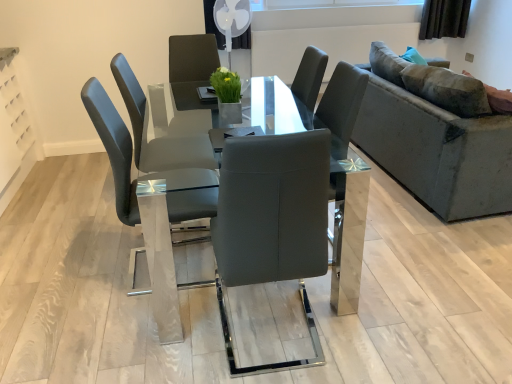
Question: Would you say velvet grey couch at right is a long distance from matte gray chair at center?

Choices:
 (A) yes
 (B) no

Answer: (A)

Question: Is velvet grey couch at right positioned in front of matte gray chair at center?

Choices:
 (A) yes
 (B) no

Answer: (B)

Question: From a real-world perspective, is velvet grey couch at right under matte gray chair at center?

Choices:
 (A) yes
 (B) no

Answer: (A)

Question: Is velvet grey couch at right positioned behind matte gray chair at center?

Choices:
 (A) yes
 (B) no

Answer: (A)

Question: Can you confirm if velvet grey couch at right is smaller than matte gray chair at center?

Choices:
 (A) no
 (B) yes

Answer: (A)

Question: Considering the relative sizes of velvet grey couch at right and matte gray chair at center in the image provided, is velvet grey couch at right taller than matte gray chair at center?

Choices:
 (A) no
 (B) yes

Answer: (A)

Question: Considering the relative positions of transparent glass table at center and matte gray chair at center in the image provided, is transparent glass table at center to the left of matte gray chair at center from the viewer's perspective?

Choices:
 (A) yes
 (B) no

Answer: (B)

Question: Can you confirm if transparent glass table at center is wider than matte gray chair at center?

Choices:
 (A) yes
 (B) no

Answer: (A)

Question: Is matte gray chair at center at the back of transparent glass table at center?

Choices:
 (A) no
 (B) yes

Answer: (B)

Question: From the image's perspective, is transparent glass table at center above matte gray chair at center?

Choices:
 (A) no
 (B) yes

Answer: (A)

Question: Is transparent glass table at center shorter than matte gray chair at center?

Choices:
 (A) no
 (B) yes

Answer: (B)

Question: Considering the relative sizes of transparent glass table at center and matte gray chair at center in the image provided, is transparent glass table at center bigger than matte gray chair at center?

Choices:
 (A) no
 (B) yes

Answer: (B)

Question: Is the surface of matte gray chair at center in direct contact with transparent glass table at center?

Choices:
 (A) no
 (B) yes

Answer: (A)